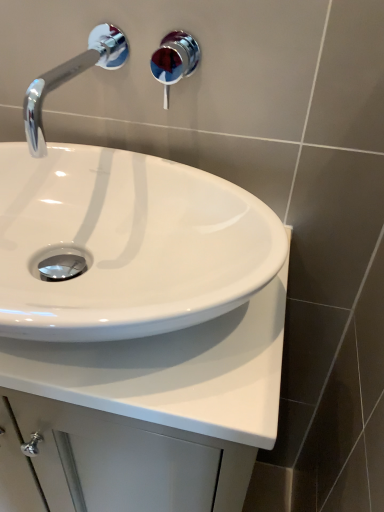
Question: Is there a large distance between chrome/metallic faucet at upper left and white glossy countertop at center?

Choices:
 (A) yes
 (B) no

Answer: (B)

Question: Could you tell me if chrome/metallic faucet at upper left is turned towards white glossy countertop at center?

Choices:
 (A) yes
 (B) no

Answer: (B)

Question: Is chrome/metallic faucet at upper left positioned with its back to white glossy countertop at center?

Choices:
 (A) yes
 (B) no

Answer: (B)

Question: Can you confirm if chrome/metallic faucet at upper left is bigger than white glossy countertop at center?

Choices:
 (A) no
 (B) yes

Answer: (A)

Question: Is chrome/metallic faucet at upper left smaller than white glossy countertop at center?

Choices:
 (A) no
 (B) yes

Answer: (B)

Question: From a real-world perspective, is chrome/metallic faucet at upper left above or below white glossy countertop at center?

Choices:
 (A) above
 (B) below

Answer: (A)

Question: Is point (114, 56) positioned closer to the camera than point (243, 407)?

Choices:
 (A) farther
 (B) closer

Answer: (A)

Question: Do you think chrome/metallic faucet at upper left is within white glossy countertop at center, or outside of it?

Choices:
 (A) outside
 (B) inside

Answer: (A)

Question: Visually, is chrome/metallic faucet at upper left positioned to the left or to the right of white glossy countertop at center?

Choices:
 (A) left
 (B) right

Answer: (A)

Question: Is white glossy countertop at center in front of or behind shiny chrome shower at upper center in the image?

Choices:
 (A) front
 (B) behind

Answer: (A)

Question: From the image's perspective, is white glossy countertop at center above or below shiny chrome shower at upper center?

Choices:
 (A) above
 (B) below

Answer: (B)

Question: Is white glossy countertop at center taller or shorter than shiny chrome shower at upper center?

Choices:
 (A) tall
 (B) short

Answer: (A)

Question: Is white glossy countertop at center wider or thinner than shiny chrome shower at upper center?

Choices:
 (A) thin
 (B) wide

Answer: (B)

Question: Is chrome/metallic faucet at upper left wider or thinner than shiny chrome shower at upper center?

Choices:
 (A) thin
 (B) wide

Answer: (B)

Question: Considering their positions, is chrome/metallic faucet at upper left located in front of or behind shiny chrome shower at upper center?

Choices:
 (A) behind
 (B) front

Answer: (B)